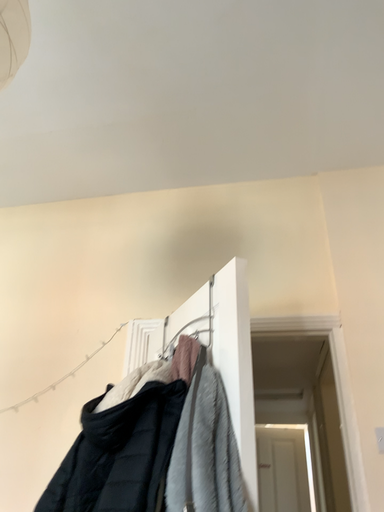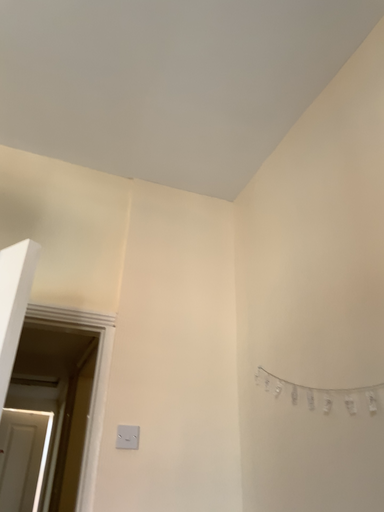
Question: Which way did the camera rotate in the video?

Choices:
 (A) rotated left
 (B) rotated right

Answer: (B)